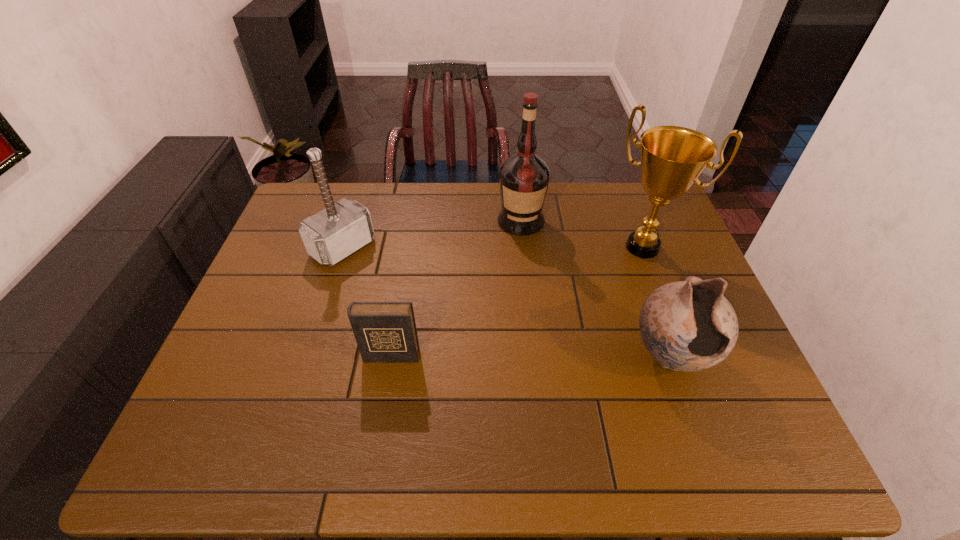
This screenshot has width=960, height=540. Find the location of `the shortest object`. the shortest object is located at coordinates (385, 332).

Locate an element on the screen. Image resolution: width=960 pixels, height=540 pixels. the fourth object from right to left is located at coordinates (385, 332).

Identify the location of pottery. (689, 325).

Locate an element on the screen. The image size is (960, 540). award is located at coordinates (672, 158).

The height and width of the screenshot is (540, 960). Find the location of `the leftmost object`. the leftmost object is located at coordinates (332, 234).

This screenshot has width=960, height=540. What are the coordinates of `the third tallest object` in the screenshot? It's located at (332, 234).

The height and width of the screenshot is (540, 960). In order to click on liquor in this screenshot , I will do `click(524, 177)`.

The image size is (960, 540). What are the coordinates of `free space located 0.090m on the front cover of the diary` in the screenshot? It's located at (384, 396).

Image resolution: width=960 pixels, height=540 pixels. I want to click on free location located on the front view with handles of the award, so click(608, 293).

Find the location of `free space located on the front view with handles of the award`. free space located on the front view with handles of the award is located at coordinates (616, 280).